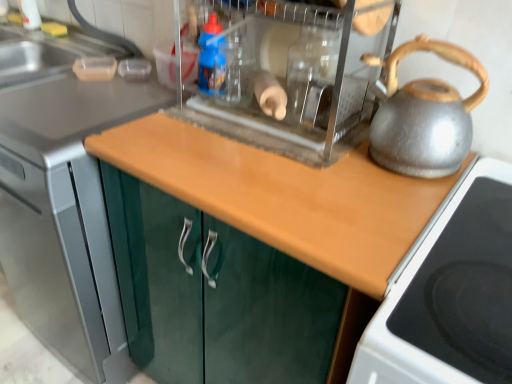
Question: Does metallic silver kettle at right have a greater height compared to wooden at center, which is the 2th countertop in right-to-left order?

Choices:
 (A) yes
 (B) no

Answer: (B)

Question: Can you confirm if metallic silver kettle at right is positioned to the right of wooden at center, which is the 2th countertop in right-to-left order?

Choices:
 (A) yes
 (B) no

Answer: (A)

Question: From the image's perspective, is metallic silver kettle at right located beneath wooden at center, which is the 2th countertop in right-to-left order?

Choices:
 (A) no
 (B) yes

Answer: (A)

Question: Does metallic silver kettle at right touch wooden at center, placed as the 1th countertop when sorted from left to right?

Choices:
 (A) no
 (B) yes

Answer: (A)

Question: Considering the relative sizes of metallic silver kettle at right and wooden at center, placed as the 1th countertop when sorted from left to right, in the image provided, is metallic silver kettle at right bigger than wooden at center, placed as the 1th countertop when sorted from left to right,?

Choices:
 (A) no
 (B) yes

Answer: (A)

Question: In terms of height, does wooden at center, which is the 2th countertop in right-to-left order, look taller or shorter compared to blue plastic bottle at center?

Choices:
 (A) short
 (B) tall

Answer: (B)

Question: From the image's perspective, relative to blue plastic bottle at center, is wooden at center, placed as the 1th countertop when sorted from left to right, above or below?

Choices:
 (A) below
 (B) above

Answer: (A)

Question: In terms of size, does wooden at center, which is the 2th countertop in right-to-left order, appear bigger or smaller than blue plastic bottle at center?

Choices:
 (A) big
 (B) small

Answer: (A)

Question: Which is correct: wooden at center, placed as the 1th countertop when sorted from left to right, is inside blue plastic bottle at center, or outside of it?

Choices:
 (A) outside
 (B) inside

Answer: (A)

Question: In the image, is wooden at center, placed as the 1th countertop when sorted from left to right, on the left side or the right side of metallic silver kettle at right?

Choices:
 (A) right
 (B) left

Answer: (B)

Question: From the image's perspective, is wooden at center, which is the 2th countertop in right-to-left order, above or below metallic silver kettle at right?

Choices:
 (A) above
 (B) below

Answer: (B)

Question: From a real-world perspective, is wooden at center, which is the 2th countertop in right-to-left order, above or below metallic silver kettle at right?

Choices:
 (A) above
 (B) below

Answer: (B)

Question: From their relative heights in the image, would you say wooden at center, which is the 2th countertop in right-to-left order, is taller or shorter than metallic silver kettle at right?

Choices:
 (A) tall
 (B) short

Answer: (A)

Question: Is point (425, 110) closer or farther from the camera than point (406, 359)?

Choices:
 (A) closer
 (B) farther

Answer: (B)

Question: From a real-world perspective, relative to black glass cooktop at right, is silver metallic kettle at right vertically above or below?

Choices:
 (A) above
 (B) below

Answer: (A)